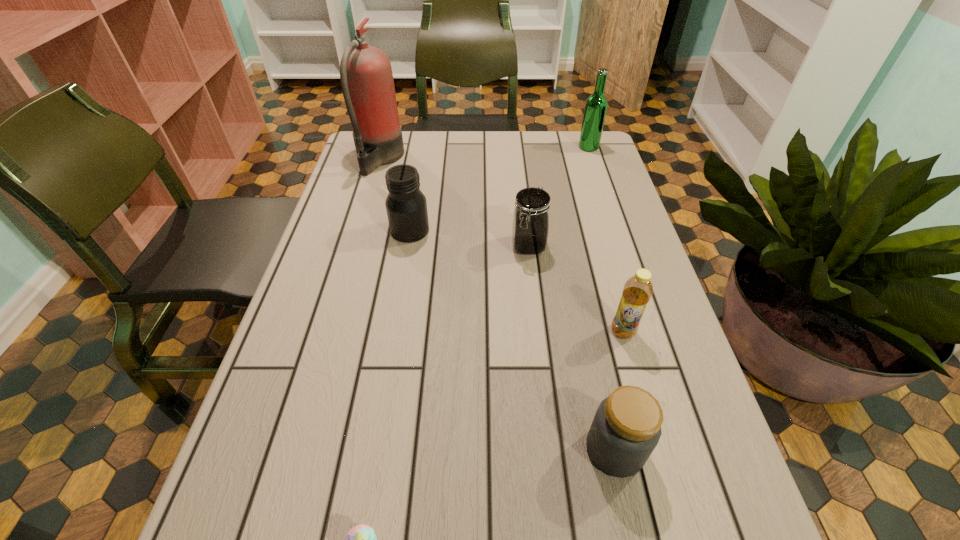
This screenshot has width=960, height=540. Identify the location of the tallest object. (366, 76).

Locate an element on the screen. The height and width of the screenshot is (540, 960). fire extinguisher is located at coordinates (366, 76).

I want to click on beer bottle, so click(x=596, y=105).

Find the location of `the tallest jar`. the tallest jar is located at coordinates (406, 206).

At what (x,y) coordinates should I click in order to perform the action: click on the third nearest object. Please return your answer as a coordinate pair (x, y). This screenshot has width=960, height=540. Looking at the image, I should click on (638, 289).

Locate an element on the screen. the second jar from right to left is located at coordinates (530, 227).

You are a GUI agent. You are given a task and a screenshot of the screen. Output one action in this format:
    pyautogui.click(x=<x>, y=<y>)
    Task: Click on the nearest jar
    The height and width of the screenshot is (540, 960).
    Given the screenshot: What is the action you would take?
    pyautogui.click(x=626, y=428)

Identify the location of the rightmost jar. (626, 428).

You are a GUI agent. You are given a task and a screenshot of the screen. Output one action in this format:
    pyautogui.click(x=<x>, y=<y>)
    Task: Click on the vacant space located 0.390m at the nozzle of the leftmost object
    This screenshot has width=960, height=540.
    Given the screenshot: What is the action you would take?
    pyautogui.click(x=529, y=159)

Where is `free space located 0.370m on the front of the beer bottle`? free space located 0.370m on the front of the beer bottle is located at coordinates click(x=615, y=227).